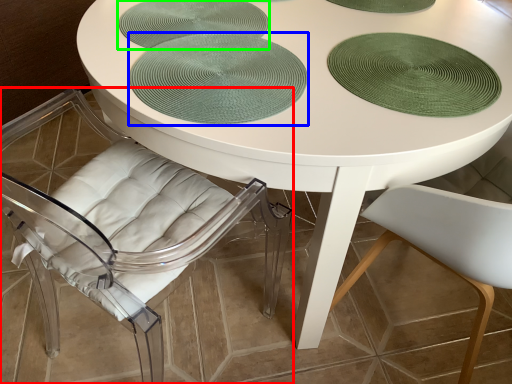
Question: Which object is positioned farthest from chair (highlighted by a red box)? Select from poker table (highlighted by a blue box) and glass plate (highlighted by a green box).

Choices:
 (A) poker table
 (B) glass plate

Answer: (A)